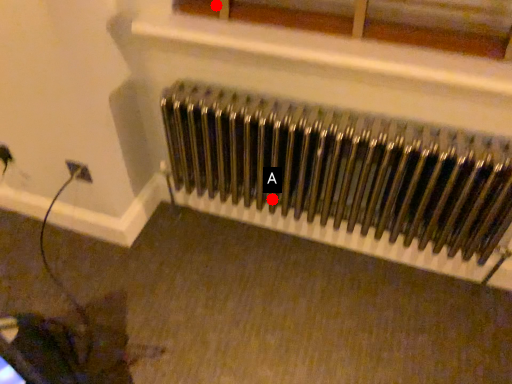
Question: Two points are circled on the image, labeled by A and B beside each circle. Which point is closer to the camera?

Choices:
 (A) A is closer
 (B) B is closer

Answer: (B)